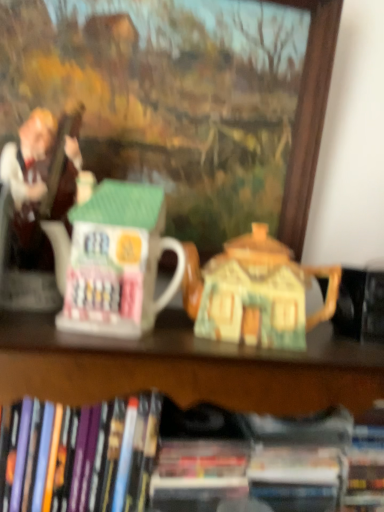
Question: Is point (137, 271) closer or farther from the camera than point (291, 464)?

Choices:
 (A) farther
 (B) closer

Answer: (B)

Question: From the image's perspective, is white glossy house-shaped mug at center positioned above or below hardcover book at lower center, which is counted as the second book, starting from the left?

Choices:
 (A) above
 (B) below

Answer: (A)

Question: Which is nearer to the matte ceramic teapot at center?

Choices:
 (A) matte brown statue at left
 (B) hardcover book at lower center, which is counted as the second book, starting from the left
 (C) hardcover book at lower left, which is the second book in right-to-left order
 (D) matte ceramic house at center
 (E) white glossy house-shaped mug at center

Answer: (E)

Question: Which is nearer to the hardcover book at lower center, which is counted as the second book, starting from the left?

Choices:
 (A) hardcover book at lower left, the first book when ordered from left to right
 (B) matte ceramic house at center
 (C) white glossy house-shaped mug at center
 (D) matte brown statue at left
 (E) matte ceramic teapot at center

Answer: (A)